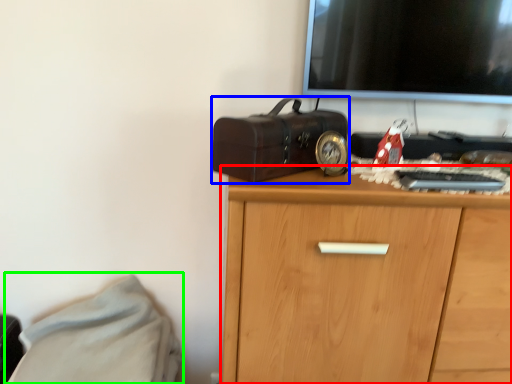
Question: Considering the real-world distances, which object is farthest from chest of drawers (highlighted by a red box)? suitcase (highlighted by a blue box) or bed (highlighted by a green box)?

Choices:
 (A) suitcase
 (B) bed

Answer: (B)